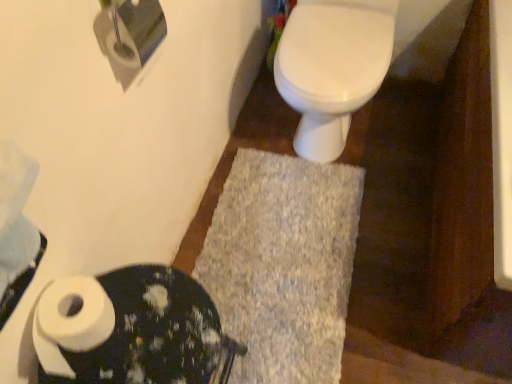
Question: Does white matte toilet paper at lower left, acting as the 1th toilet paper starting from the bottom, have a greater height compared to white glossy toilet at center?

Choices:
 (A) yes
 (B) no

Answer: (B)

Question: Is the depth of white matte toilet paper at lower left, which is the 2th toilet paper from top to bottom, less than that of white glossy toilet at center?

Choices:
 (A) no
 (B) yes

Answer: (B)

Question: From a real-world perspective, is white matte toilet paper at lower left, acting as the 1th toilet paper starting from the bottom, positioned over white glossy toilet at center based on gravity?

Choices:
 (A) yes
 (B) no

Answer: (A)

Question: Does white matte toilet paper at lower left, acting as the 1th toilet paper starting from the bottom, have a lesser height compared to white glossy toilet at center?

Choices:
 (A) no
 (B) yes

Answer: (B)

Question: Can you confirm if white matte toilet paper at lower left, which is the 2th toilet paper from top to bottom, is positioned to the left of white glossy toilet at center?

Choices:
 (A) yes
 (B) no

Answer: (A)

Question: Is white matte toilet paper at lower left, which is the 2th toilet paper from top to bottom, wider than white glossy toilet at center?

Choices:
 (A) yes
 (B) no

Answer: (B)

Question: Can you confirm if white matte toilet paper at lower left is thinner than gray shaggy bath mat at center?

Choices:
 (A) no
 (B) yes

Answer: (B)

Question: Is white matte toilet paper at lower left closer to the viewer compared to gray shaggy bath mat at center?

Choices:
 (A) yes
 (B) no

Answer: (A)

Question: Is white matte toilet paper at lower left positioned far away from gray shaggy bath mat at center?

Choices:
 (A) yes
 (B) no

Answer: (B)

Question: Can you confirm if white matte toilet paper at lower left is bigger than gray shaggy bath mat at center?

Choices:
 (A) no
 (B) yes

Answer: (B)

Question: Could you tell me if white matte toilet paper at lower left is facing gray shaggy bath mat at center?

Choices:
 (A) yes
 (B) no

Answer: (B)

Question: Does white matte toilet paper at lower left appear on the right side of gray shaggy bath mat at center?

Choices:
 (A) no
 (B) yes

Answer: (A)

Question: Can you confirm if white matte toilet paper at upper left, the 1th toilet paper positioned from the top, is bigger than white matte toilet paper at lower left?

Choices:
 (A) yes
 (B) no

Answer: (B)